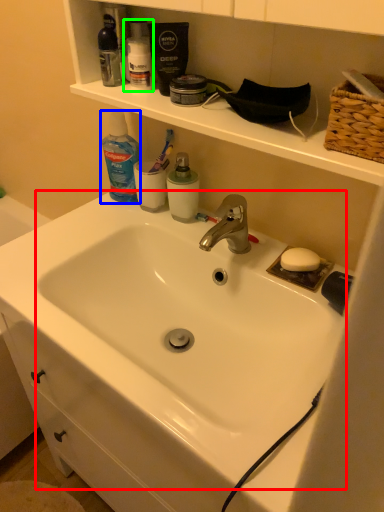
Question: Estimate the real-world distances between objects in this image. Which object is closer to sink (highlighted by a red box), cleaning product (highlighted by a blue box) or toiletry (highlighted by a green box)?

Choices:
 (A) cleaning product
 (B) toiletry

Answer: (A)